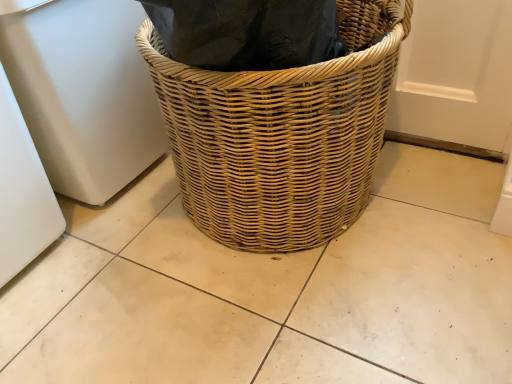
Question: From a real-world perspective, relative to white matte refrigerator at left, is natural woven basket at center vertically above or below?

Choices:
 (A) below
 (B) above

Answer: (A)

Question: From the image's perspective, is natural woven basket at center located above or below white matte refrigerator at left?

Choices:
 (A) below
 (B) above

Answer: (A)

Question: Would you say natural woven basket at center is to the left or to the right of white matte refrigerator at left in the picture?

Choices:
 (A) right
 (B) left

Answer: (A)

Question: From a real-world perspective, is white matte refrigerator at left above or below natural woven basket at center?

Choices:
 (A) below
 (B) above

Answer: (B)

Question: Is white matte refrigerator at left taller or shorter than natural woven basket at center?

Choices:
 (A) short
 (B) tall

Answer: (B)

Question: Considering the positions of white matte refrigerator at left and natural woven basket at center in the image, is white matte refrigerator at left bigger or smaller than natural woven basket at center?

Choices:
 (A) big
 (B) small

Answer: (B)

Question: Is white matte refrigerator at left inside the boundaries of natural woven basket at center, or outside?

Choices:
 (A) outside
 (B) inside

Answer: (A)